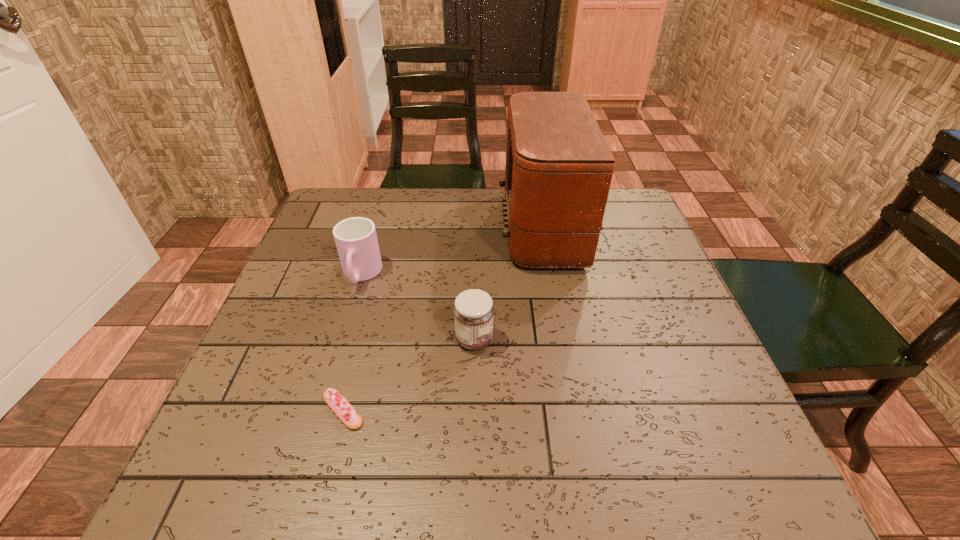
Find the location of a particular element. the tallest object is located at coordinates (559, 167).

I want to click on the rightmost object, so click(559, 167).

You are a GUI agent. You are given a task and a screenshot of the screen. Output one action in this format:
    pyautogui.click(x=<x>, y=<y>)
    Task: Click on the cup
    
    Given the screenshot: What is the action you would take?
    pyautogui.click(x=356, y=240)

The width and height of the screenshot is (960, 540). In order to click on the third object from left to right in this screenshot , I will do `click(473, 312)`.

The height and width of the screenshot is (540, 960). Find the location of `the second nearest object`. the second nearest object is located at coordinates (473, 312).

This screenshot has height=540, width=960. Find the location of `eclair`. eclair is located at coordinates (339, 405).

Identify the location of the shortest object. (339, 405).

Image resolution: width=960 pixels, height=540 pixels. In order to click on vacant space located on the front panel of the tallest object in this screenshot , I will do `click(376, 228)`.

Locate an element on the screen. This screenshot has height=540, width=960. vacant space located on the front panel of the tallest object is located at coordinates (380, 228).

I want to click on vacant space located 0.390m on the front panel of the tallest object, so click(354, 228).